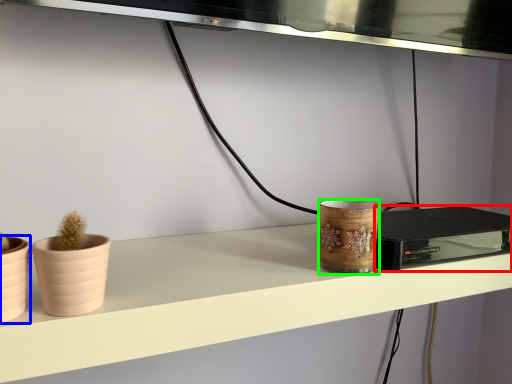
Question: Based on their relative distances, which object is farther from appliance (highlighted by a red box)? Choose from flowerpot (highlighted by a blue box) and pottery (highlighted by a green box).

Choices:
 (A) flowerpot
 (B) pottery

Answer: (A)